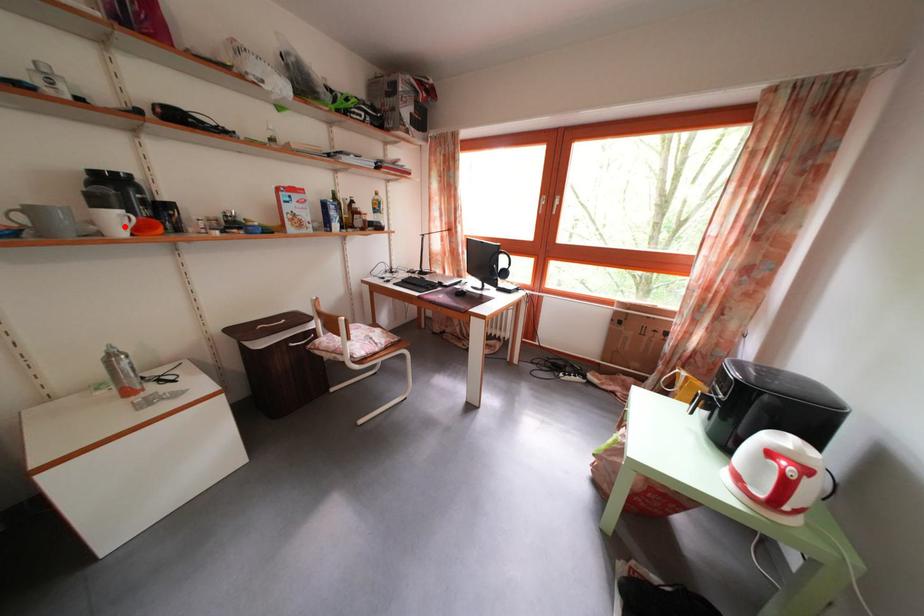
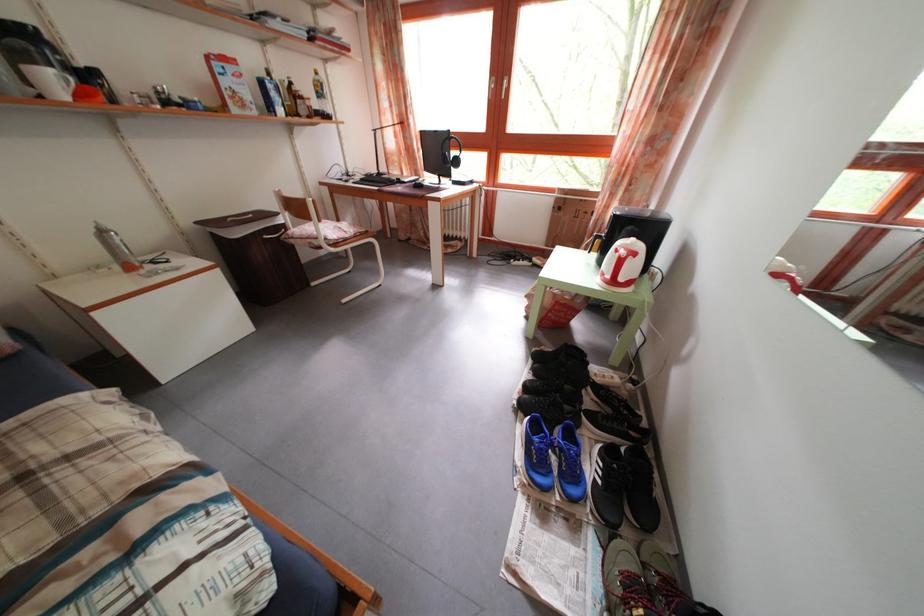
Question: I am providing you with two images of the same scene from different viewpoints. Image1 has a red point marked. In image2, the corresponding 3D location appears at what relative position? Reply with the corresponding letter.

Choices:
 (A) Closer
 (B) Farther

Answer: (B)